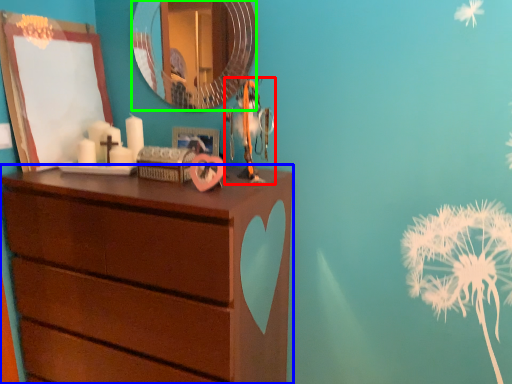
Question: Which object is positioned farthest from toy (highlighted by a red box)? Select from chest of drawers (highlighted by a blue box) and mirror (highlighted by a green box).

Choices:
 (A) chest of drawers
 (B) mirror

Answer: (B)